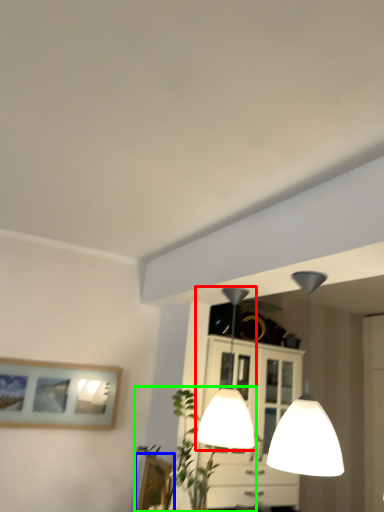
Question: Which object is the farthest from lamp (highlighted by a red box)? Choose among these: picture frame (highlighted by a blue box) or plant (highlighted by a green box).

Choices:
 (A) picture frame
 (B) plant

Answer: (A)